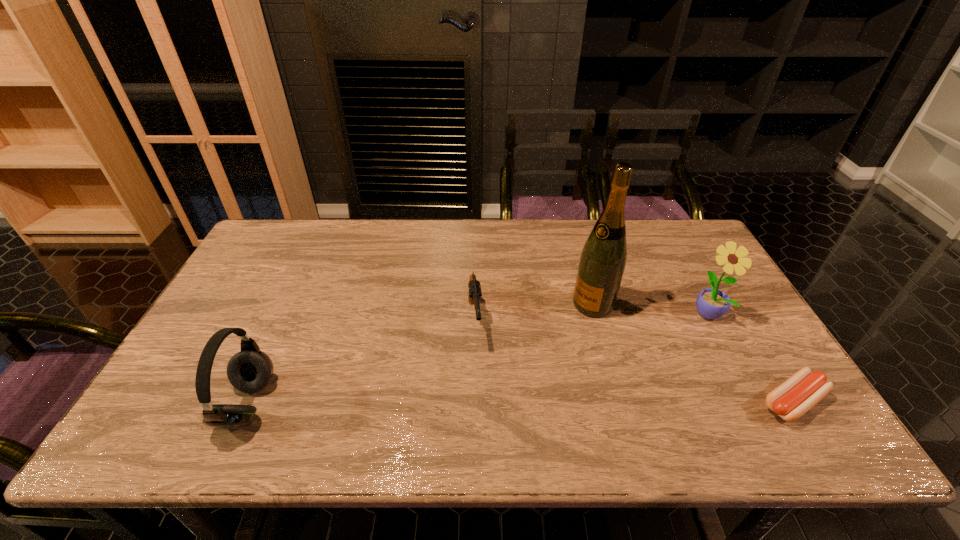
Identify the location of vacant space located 0.270m on the front-facing side of the sunflower. This screenshot has height=540, width=960. (636, 367).

Identify the location of vacant space located on the front-facing side of the sunflower. The width and height of the screenshot is (960, 540). (653, 354).

The image size is (960, 540). In order to click on vacant region located on the front-facing side of the sunflower in this screenshot , I will do `click(673, 341)`.

This screenshot has height=540, width=960. What are the coordinates of `vacant position located 0.340m on the front-facing side of the wine bottle` in the screenshot? It's located at (492, 379).

Find the location of `vacant area located on the front-facing side of the wine bottle`. vacant area located on the front-facing side of the wine bottle is located at coordinates (477, 390).

Find the location of a particular element. vacant space situated on the front-facing side of the wine bottle is located at coordinates (517, 360).

Identify the location of free space located 0.120m along the barrel of the gun. (479, 390).

At what (x,y) coordinates should I click in order to perform the action: click on free spot located 0.090m along the barrel of the gun. Please return your answer as a coordinate pair (x, y). This screenshot has height=540, width=960. Looking at the image, I should click on (478, 380).

Where is `vacant area located 0.140m along the barrel of the gun`? Image resolution: width=960 pixels, height=540 pixels. vacant area located 0.140m along the barrel of the gun is located at coordinates (480, 398).

Locate an element on the screen. headset present at the near edge is located at coordinates (249, 371).